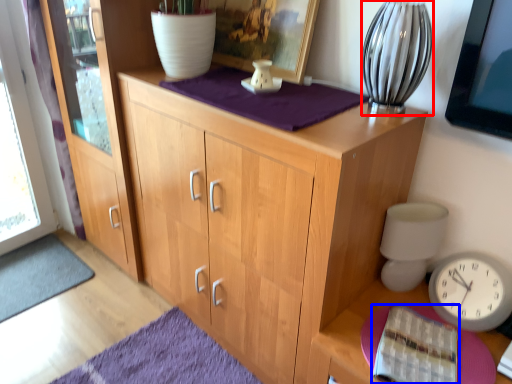
Question: Which point is closer to the camera, glass vase (highlighted by a red box) or book (highlighted by a blue box)?

Choices:
 (A) glass vase
 (B) book

Answer: (B)